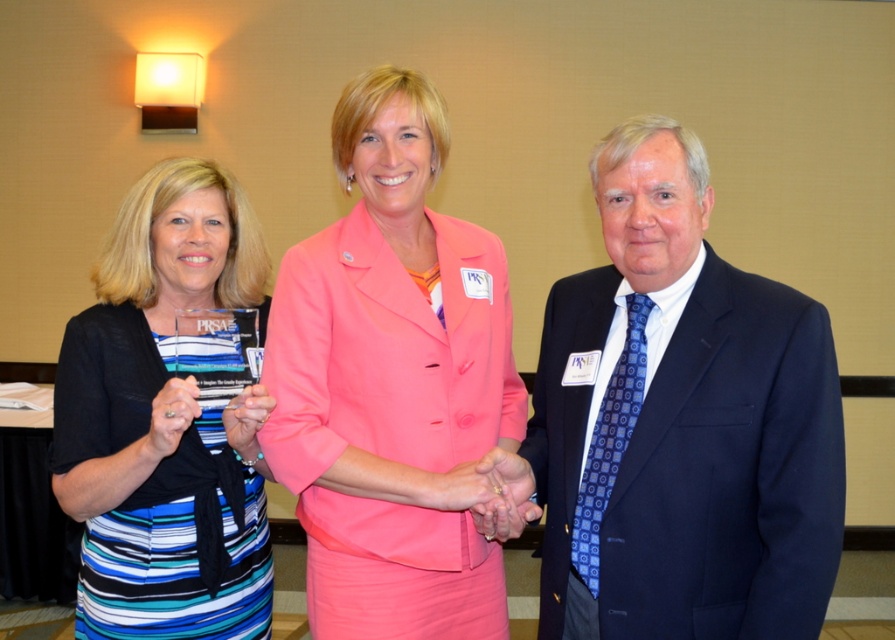
Based on the photo, you are a photographer at this event and need to adjust the lighting. The pink fabric jacket at center and striped fabric dress at center are too close together. What is the minimum distance you should set between them to ensure proper lighting coverage?

The minimum distance should be at least 10.84 inches to maintain the current spacing between the pink fabric jacket at center and striped fabric dress at center for proper lighting coverage.

You are standing in front of the photograph and want to touch the two points labeled in the image. Which point, point [307,577] or point [177,516], is closer to your hand when you reach out?

Point [307,577] is closer to the viewer than point [177,516], so it would be closer to your hand when you reach out.